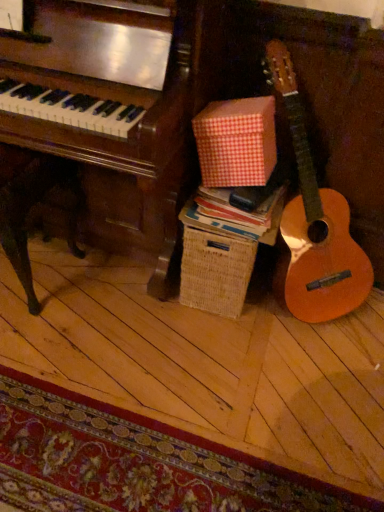
At what (x,y) coordinates should I click in order to perform the action: click on red checkered cardboard box at center. Please return your answer as a coordinate pair (x, y). The image size is (384, 512). Looking at the image, I should click on (236, 142).

Locate an element on the screen. The image size is (384, 512). carpeted mat at lower left is located at coordinates (135, 462).

Where is `red checkered paper at center`? This screenshot has height=512, width=384. red checkered paper at center is located at coordinates tap(234, 215).

Identify the location of red checkered cardboard box at center. (236, 142).

Is red checkered paper at center to the right of red checkered cardboard box at center from the viewer's perspective?

Correct, you'll find red checkered paper at center to the right of red checkered cardboard box at center.

Locate an element on the screen. The image size is (384, 512). book behind the red checkered cardboard box at center is located at coordinates (234, 215).

Is red checkered paper at center not close to red checkered cardboard box at center?

red checkered paper at center is near red checkered cardboard box at center, not far away.

From the image's perspective, between red checkered paper at center and red checkered cardboard box at center, which one is located above?

red checkered cardboard box at center appears higher in the image.

Between red checkered cardboard box at center and red checkered paper at center, which one has more height?

With more height is red checkered cardboard box at center.

From a real-world perspective, which object rests below the other?

In real-world perspective, red checkered paper at center is lower.

Where is `cardboard box above the red checkered paper at center (from a real-world perspective)`? This screenshot has width=384, height=512. cardboard box above the red checkered paper at center (from a real-world perspective) is located at coordinates (236, 142).

Is red checkered paper at center facing towards carpeted mat at lower left?

No, red checkered paper at center is not turned towards carpeted mat at lower left.

I want to click on mat on the left of red checkered paper at center, so click(x=135, y=462).

Which of these two, red checkered paper at center or carpeted mat at lower left, stands taller?

Standing taller between the two is red checkered paper at center.

From the image's perspective, is carpeted mat at lower left located above or below red checkered paper at center?

carpeted mat at lower left is below red checkered paper at center.

Find the location of a particular element. This screenshot has width=384, height=512. book above the carpeted mat at lower left (from the image's perspective) is located at coordinates (234, 215).

Does carpeted mat at lower left have a greater width compared to red checkered paper at center?

Yes, carpeted mat at lower left is wider than red checkered paper at center.

Is there a large distance between carpeted mat at lower left and red checkered cardboard box at center?

No, carpeted mat at lower left is not far away from red checkered cardboard box at center.

Is carpeted mat at lower left at the right side of red checkered cardboard box at center?

No, carpeted mat at lower left is not to the right of red checkered cardboard box at center.

Is carpeted mat at lower left turned away from red checkered cardboard box at center?

That's not correct — carpeted mat at lower left is not looking away from red checkered cardboard box at center.

Considering the positions of objects red checkered cardboard box at center and carpeted mat at lower left in the image provided, who is more to the left, red checkered cardboard box at center or carpeted mat at lower left?

Positioned to the left is carpeted mat at lower left.

In the image, there is a red checkered cardboard box at center. Where is `mat below it (from the image's perspective)`? Image resolution: width=384 pixels, height=512 pixels. mat below it (from the image's perspective) is located at coordinates (135, 462).

Is red checkered cardboard box at center further to the viewer compared to carpeted mat at lower left?

Yes, it is.

The image size is (384, 512). Find the location of `book to the right of red checkered cardboard box at center`. book to the right of red checkered cardboard box at center is located at coordinates (234, 215).

Find the location of a particular element. book that is below the red checkered cardboard box at center (from the image's perspective) is located at coordinates (234, 215).

Looking at the image, which one is located closer to carpeted mat at lower left, red checkered paper at center or red checkered cardboard box at center?

Based on the image, red checkered paper at center appears to be nearer to carpeted mat at lower left.

When comparing their distances from red checkered cardboard box at center, does carpeted mat at lower left or red checkered paper at center seem further?

carpeted mat at lower left is further to red checkered cardboard box at center.

When comparing their distances from red checkered cardboard box at center, does red checkered paper at center or carpeted mat at lower left seem further?

Based on the image, carpeted mat at lower left appears to be further to red checkered cardboard box at center.

In the scene shown: Which object lies nearer to the anchor point red checkered paper at center, carpeted mat at lower left or red checkered cardboard box at center?

red checkered cardboard box at center is closer to red checkered paper at center.

When comparing their distances from red checkered paper at center, does red checkered cardboard box at center or carpeted mat at lower left seem closer?

Among the two, red checkered cardboard box at center is located nearer to red checkered paper at center.

Considering their positions, is red checkered cardboard box at center positioned further to carpeted mat at lower left than red checkered paper at center?

red checkered cardboard box at center is further to carpeted mat at lower left.

At what (x,y) coordinates should I click in order to perform the action: click on book between red checkered cardboard box at center and carpeted mat at lower left from top to bottom. Please return your answer as a coordinate pair (x, y). Looking at the image, I should click on (234, 215).